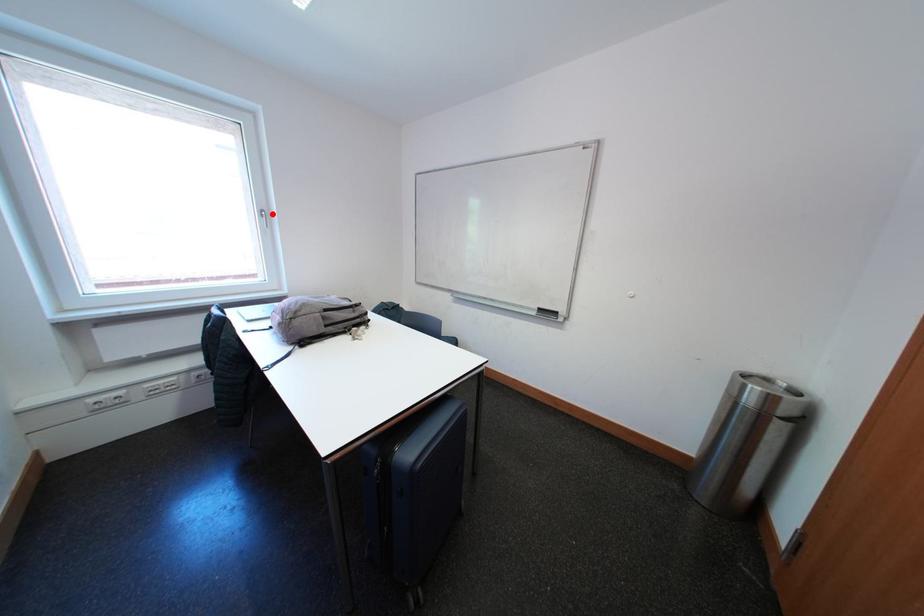
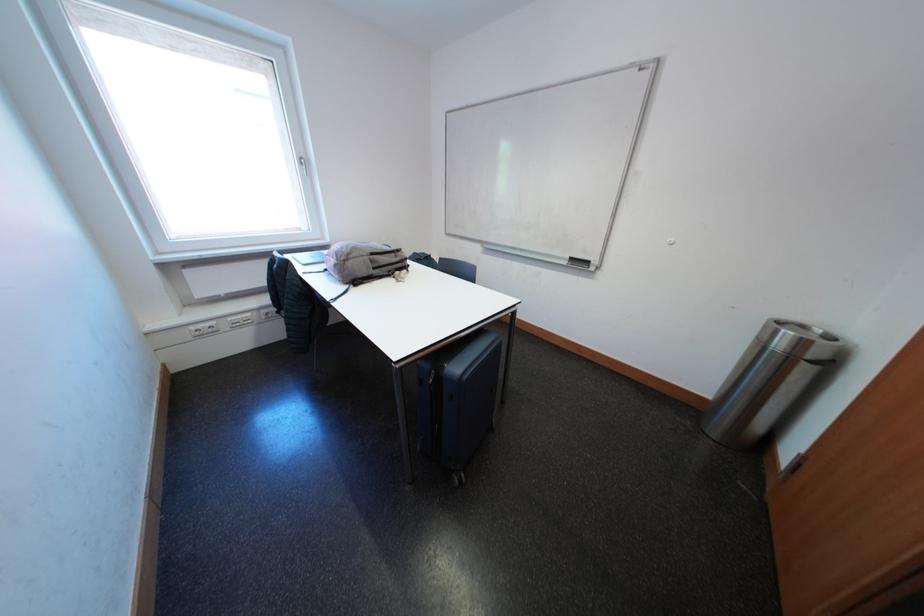
Where in the second image is the point corresponding to the highlighted location from the first image?

(311, 163)